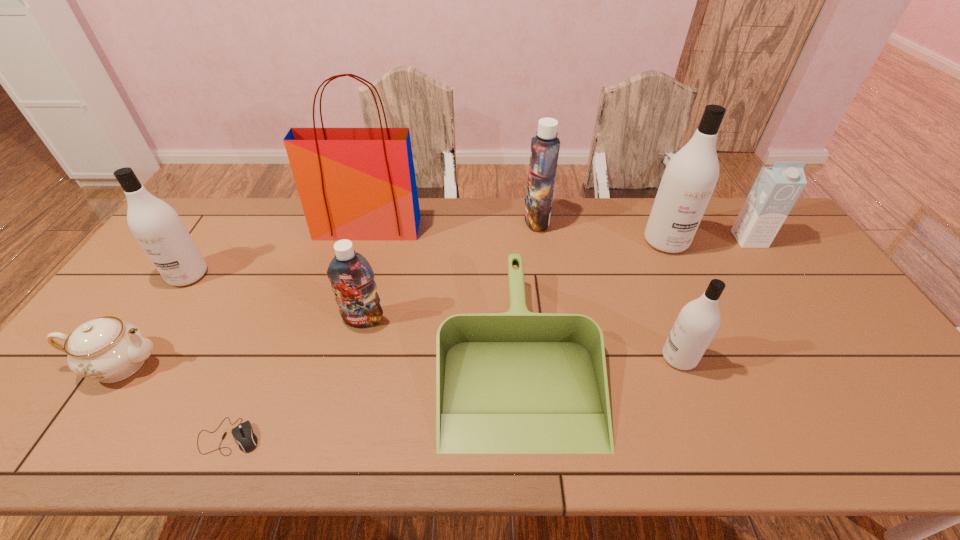
Select which shampoo is the fifth closest to the shortest object. Please provide its 2D coordinates. Your answer should be formatted as a tuple, i.e. [(x, y)], where the tuple contains the x and y coordinates of a point satisfying the conditions above.

[(691, 175)]

Select which white shampoo is the second closest to the smaller blue shampoo. Please provide its 2D coordinates. Your answer should be formatted as a tuple, i.e. [(x, y)], where the tuple contains the x and y coordinates of a point satisfying the conditions above.

[(698, 321)]

Point out which white shampoo is positioned as the second nearest to the leftmost white shampoo. Please provide its 2D coordinates. Your answer should be formatted as a tuple, i.e. [(x, y)], where the tuple contains the x and y coordinates of a point satisfying the conditions above.

[(691, 175)]

The width and height of the screenshot is (960, 540). What are the coordinates of `vacant space that satisfies the following two spatial constraints: 1. on the front label of the carton; 2. at the spout of the third shortest object` in the screenshot? It's located at (832, 364).

The height and width of the screenshot is (540, 960). I want to click on vacant space that satisfies the following two spatial constraints: 1. on the front label of the rightmost object; 2. at the spout of the chinaware, so click(x=832, y=364).

Image resolution: width=960 pixels, height=540 pixels. Identify the location of vacant region that satisfies the following two spatial constraints: 1. on the scoop of the ninth tallest object; 2. at the spout of the eighth tallest object. (518, 364).

This screenshot has width=960, height=540. In order to click on vacant space that satisfies the following two spatial constraints: 1. on the front-facing side of the second biggest white shampoo; 2. on the right side of the computer mouse in this screenshot , I will do `click(81, 436)`.

Where is `free space in the image that satisfies the following two spatial constraints: 1. on the front-facing side of the tallest shampoo; 2. on the front-facing side of the smallest white shampoo`? free space in the image that satisfies the following two spatial constraints: 1. on the front-facing side of the tallest shampoo; 2. on the front-facing side of the smallest white shampoo is located at coordinates (719, 357).

You are a GUI agent. You are given a task and a screenshot of the screen. Output one action in this format:
    pyautogui.click(x=<x>, y=<y>)
    Task: Click on the free spot that satisfies the following two spatial constraints: 1. at the spout of the chinaware; 2. on the back side of the computer mouse
    
    Given the screenshot: What is the action you would take?
    pyautogui.click(x=70, y=436)

Find the location of a particular element. The width and height of the screenshot is (960, 540). free space in the image that satisfies the following two spatial constraints: 1. on the front-facing side of the leftmost shampoo; 2. on the left side of the shortest object is located at coordinates (81, 436).